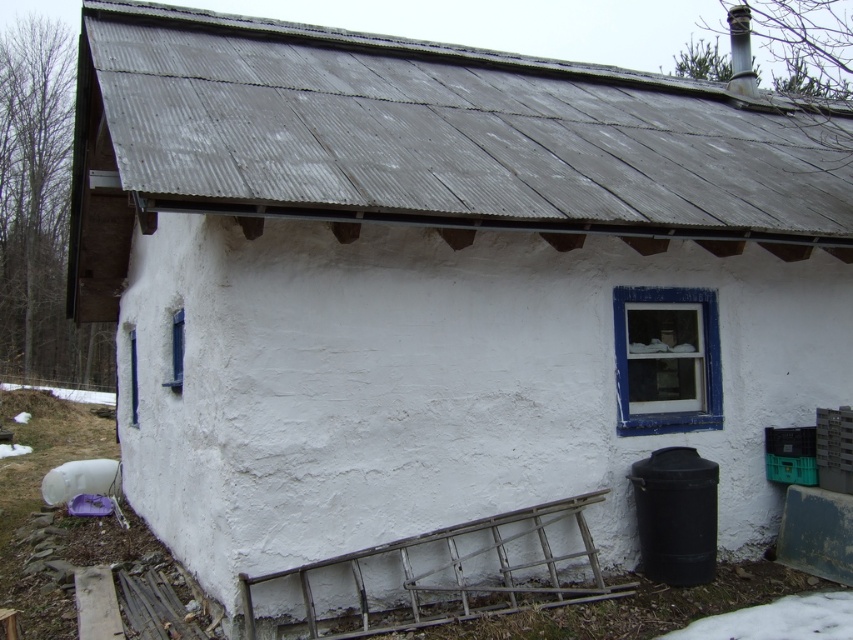
Between white powdery snow at lower right and blue matte window at left, which one has less height?

With less height is white powdery snow at lower right.

Which is more to the left, white powdery snow at lower right or blue matte window at left?

Answer: From the viewer's perspective, blue matte window at left appears more on the left side.

Between point (753, 621) and point (172, 333), which one is positioned in front?

Positioned in front is point (753, 621).

You are a GUI agent. You are given a task and a screenshot of the screen. Output one action in this format:
    pyautogui.click(x=<x>, y=<y>)
    Task: Click on the white powdery snow at lower right
    The image size is (853, 640).
    Given the screenshot: What is the action you would take?
    pyautogui.click(x=778, y=620)

How much distance is there between blue painted wood window at right and blue matte window at left?

14.46 feet

You are a GUI agent. You are given a task and a screenshot of the screen. Output one action in this format:
    pyautogui.click(x=<x>, y=<y>)
    Task: Click on the blue painted wood window at right
    
    Given the screenshot: What is the action you would take?
    pyautogui.click(x=666, y=358)

The width and height of the screenshot is (853, 640). In order to click on blue painted wood window at right in this screenshot , I will do `click(666, 358)`.

Consider the image. Can you confirm if gray corrugated metal roof at upper center is thinner than blue painted wood window at right?

No, gray corrugated metal roof at upper center is not thinner than blue painted wood window at right.

Based on the photo, who is more distant from viewer, (730, 196) or (619, 372)?

Point (730, 196)

Where is `gray corrugated metal roof at upper center`? This screenshot has height=640, width=853. gray corrugated metal roof at upper center is located at coordinates (451, 132).